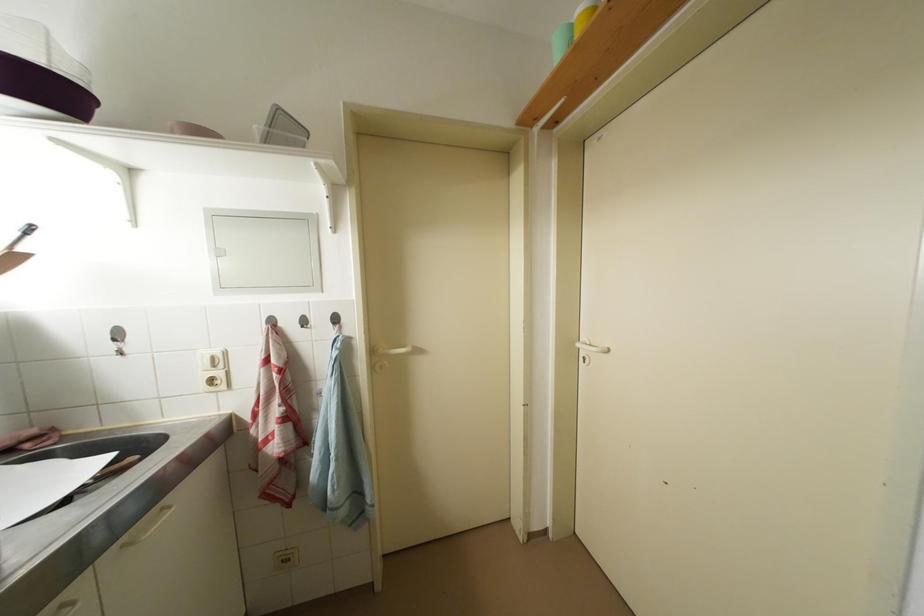
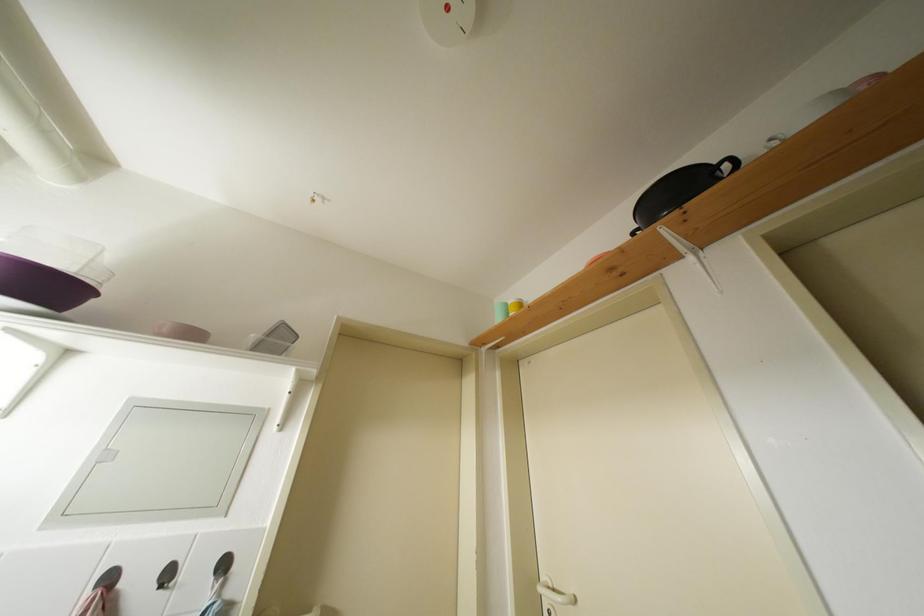
Question: Based on the continuous images, in which direction is the camera rotating? Reply with the corresponding letter.

Choices:
 (A) Left
 (B) Right
 (C) Up
 (D) Down

Answer: (C)